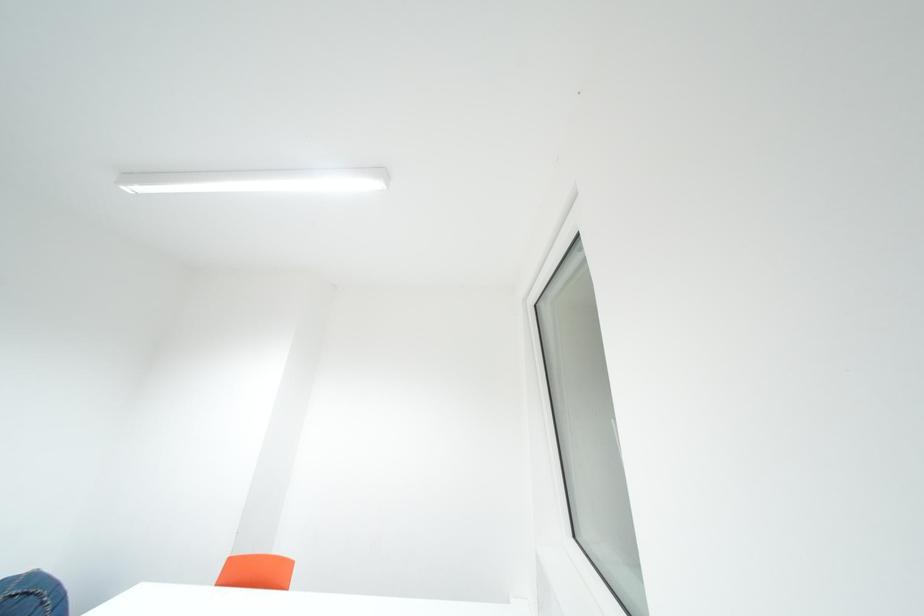
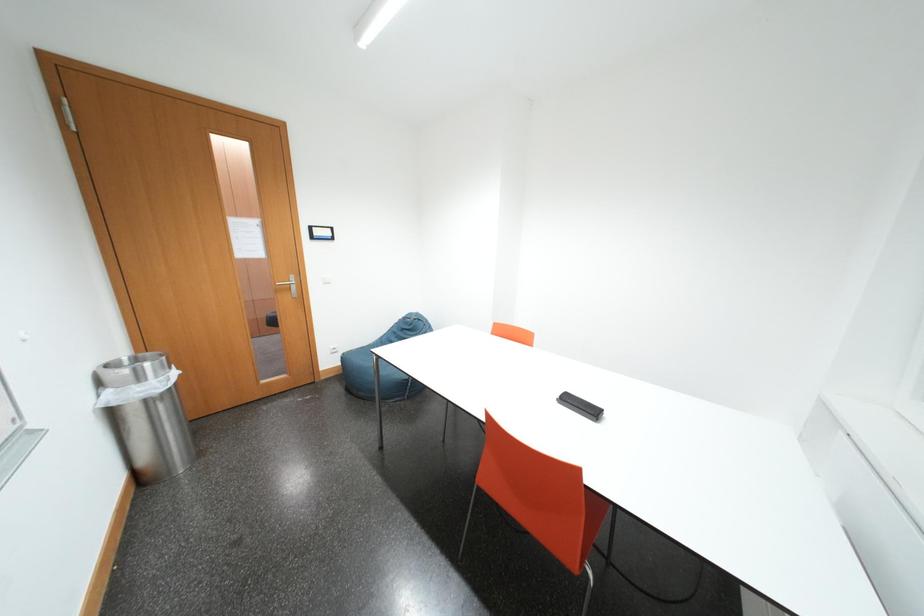
The first image is from the beginning of the video and the second image is from the end. How did the camera likely rotate when shooting the video?

The camera's rotation is toward left-down.